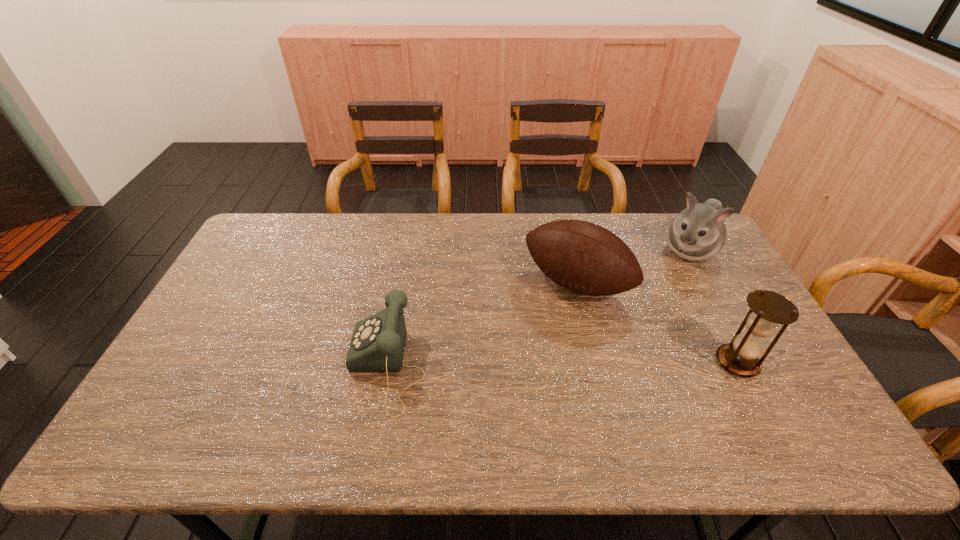
What are the coordinates of `the shortest object` in the screenshot? It's located at (378, 342).

Locate an element on the screen. This screenshot has width=960, height=540. telephone is located at coordinates (378, 342).

Find the location of `hourglass`. hourglass is located at coordinates (768, 309).

Locate an element on the screen. The height and width of the screenshot is (540, 960). hamster is located at coordinates (698, 233).

Where is `football`? football is located at coordinates (581, 256).

Find the location of a particular element. This screenshot has width=960, height=540. vacant space located 0.220m on the dial of the telephone is located at coordinates (266, 367).

This screenshot has height=540, width=960. In order to click on free space located 0.110m on the dial of the telephone in this screenshot , I will do `click(307, 367)`.

Find the location of a particular element. The height and width of the screenshot is (540, 960). vacant space located 0.300m on the dial of the telephone is located at coordinates (236, 367).

This screenshot has width=960, height=540. Identify the location of vacant area situated on the left of the hourglass. (653, 362).

Where is `free space located 0.200m on the face of the hamster`? This screenshot has width=960, height=540. free space located 0.200m on the face of the hamster is located at coordinates (657, 301).